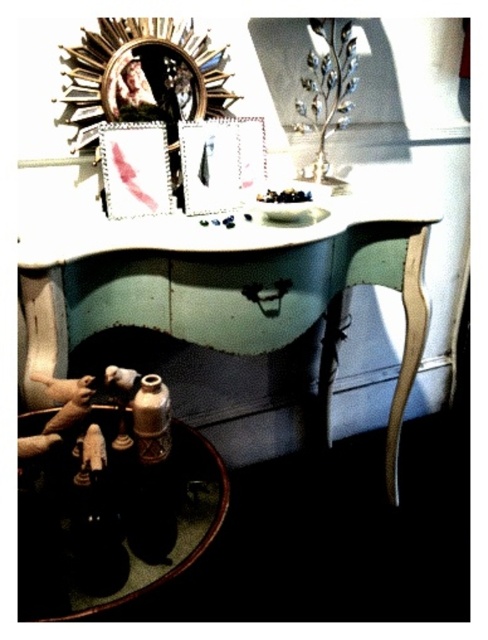
Measure the distance between shiny brown wood at lower left and metallic silver picture frame at upper center.

The distance of shiny brown wood at lower left from metallic silver picture frame at upper center is 22.86 inches.

Is shiny brown wood at lower left further to camera compared to metallic silver picture frame at upper center?

No.

Where is `shiny brown wood at lower left`? shiny brown wood at lower left is located at coordinates (125, 532).

Image resolution: width=488 pixels, height=640 pixels. I want to click on shiny brown wood at lower left, so click(125, 532).

Is matte black picture frame at center positioned in front of metallic silver picture frame at upper center?

No, it is behind metallic silver picture frame at upper center.

Describe the element at coordinates (222, 163) in the screenshot. I see `matte black picture frame at center` at that location.

Where is `matte black picture frame at center`? The width and height of the screenshot is (488, 640). matte black picture frame at center is located at coordinates (222, 163).

Can you confirm if shiny brown wood at lower left is taller than matte black picture frame at center?

Incorrect, shiny brown wood at lower left's height is not larger of matte black picture frame at center's.

Who is positioned more to the right, shiny brown wood at lower left or matte black picture frame at center?

From the viewer's perspective, matte black picture frame at center appears more on the right side.

Between point (131, 596) and point (181, 172), which one is positioned behind?

The point (181, 172) is behind.

The height and width of the screenshot is (640, 488). What are the coordinates of `shiny brown wood at lower left` in the screenshot? It's located at (125, 532).